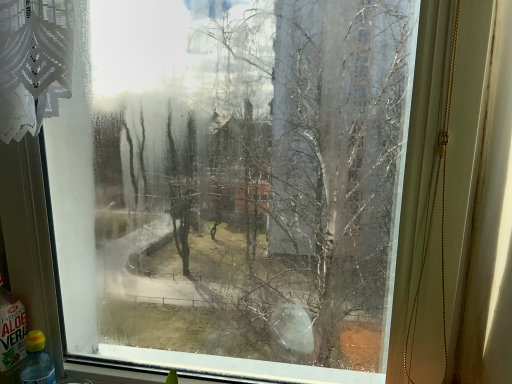
Image resolution: width=512 pixels, height=384 pixels. Describe the element at coordinates (11, 336) in the screenshot. I see `translucent plastic bottle at lower left, which is counted as the 1th bottle, starting from the left` at that location.

Where is `translucent plastic bottle at lower left, which is counted as the 1th bottle, starting from the left`? This screenshot has width=512, height=384. translucent plastic bottle at lower left, which is counted as the 1th bottle, starting from the left is located at coordinates (11, 336).

Locate an element on the screen. This screenshot has height=384, width=512. translucent plastic bottle at lower left, the 1th bottle when ordered from right to left is located at coordinates (37, 361).

What is the approximate width of translucent plastic bottle at lower left, the 1th bottle when ordered from right to left?

It is 3.04 inches.

Image resolution: width=512 pixels, height=384 pixels. What do you see at coordinates (37, 361) in the screenshot?
I see `translucent plastic bottle at lower left, the 1th bottle when ordered from right to left` at bounding box center [37, 361].

Find the location of a particular element. The image size is (512, 384). translucent plastic bottle at lower left, which ranks as the second bottle in right-to-left order is located at coordinates (11, 336).

Consider the image. Which object is positioned more to the right, translucent plastic bottle at lower left, marked as the second bottle in a left-to-right arrangement, or translucent plastic bottle at lower left, which is counted as the 1th bottle, starting from the left?

translucent plastic bottle at lower left, marked as the second bottle in a left-to-right arrangement, is more to the right.

Which object is more forward, translucent plastic bottle at lower left, the 1th bottle when ordered from right to left, or translucent plastic bottle at lower left, which is counted as the 1th bottle, starting from the left?

translucent plastic bottle at lower left, which is counted as the 1th bottle, starting from the left.

Is point (24, 372) behind point (15, 352)?

Yes, point (24, 372) is behind point (15, 352).

From the image's perspective, is translucent plastic bottle at lower left, the 1th bottle when ordered from right to left, on top of translucent plastic bottle at lower left, which ranks as the second bottle in right-to-left order?

No, from the image's perspective, translucent plastic bottle at lower left, the 1th bottle when ordered from right to left, is not on top of translucent plastic bottle at lower left, which ranks as the second bottle in right-to-left order.

From a real-world perspective, is translucent plastic bottle at lower left, the 1th bottle when ordered from right to left, located beneath translucent plastic bottle at lower left, which is counted as the 1th bottle, starting from the left?

Indeed, from a real-world perspective, translucent plastic bottle at lower left, the 1th bottle when ordered from right to left, is positioned beneath translucent plastic bottle at lower left, which is counted as the 1th bottle, starting from the left.

Is translucent plastic bottle at lower left, the 1th bottle when ordered from right to left, wider than translucent plastic bottle at lower left, which is counted as the 1th bottle, starting from the left?

In fact, translucent plastic bottle at lower left, the 1th bottle when ordered from right to left, might be narrower than translucent plastic bottle at lower left, which is counted as the 1th bottle, starting from the left.

Is translucent plastic bottle at lower left, the 1th bottle when ordered from right to left, taller than translucent plastic bottle at lower left, which is counted as the 1th bottle, starting from the left?

Incorrect, the height of translucent plastic bottle at lower left, the 1th bottle when ordered from right to left, is not larger of that of translucent plastic bottle at lower left, which is counted as the 1th bottle, starting from the left.

Between translucent plastic bottle at lower left, the 1th bottle when ordered from right to left, and translucent plastic bottle at lower left, which is counted as the 1th bottle, starting from the left, which one has smaller size?

translucent plastic bottle at lower left, the 1th bottle when ordered from right to left, is smaller.

Do you think translucent plastic bottle at lower left, the 1th bottle when ordered from right to left, is within translucent plastic bottle at lower left, which ranks as the second bottle in right-to-left order, or outside of it?

translucent plastic bottle at lower left, the 1th bottle when ordered from right to left, lies outside translucent plastic bottle at lower left, which ranks as the second bottle in right-to-left order.

Can you see translucent plastic bottle at lower left, marked as the second bottle in a left-to-right arrangement, touching translucent plastic bottle at lower left, which is counted as the 1th bottle, starting from the left?

Yes, translucent plastic bottle at lower left, marked as the second bottle in a left-to-right arrangement, is in contact with translucent plastic bottle at lower left, which is counted as the 1th bottle, starting from the left.

Is translucent plastic bottle at lower left, the 1th bottle when ordered from right to left, positioned with its back to translucent plastic bottle at lower left, which is counted as the 1th bottle, starting from the left?

That's not correct — translucent plastic bottle at lower left, the 1th bottle when ordered from right to left, is not looking away from translucent plastic bottle at lower left, which is counted as the 1th bottle, starting from the left.

Can you tell me how much translucent plastic bottle at lower left, the 1th bottle when ordered from right to left, and translucent plastic bottle at lower left, which ranks as the second bottle in right-to-left order, differ in facing direction?

They differ by 4.54 degrees in their facing directions.

This screenshot has height=384, width=512. Find the location of `bottle on the left of the translucent plastic bottle at lower left, marked as the second bottle in a left-to-right arrangement`. bottle on the left of the translucent plastic bottle at lower left, marked as the second bottle in a left-to-right arrangement is located at coordinates (11, 336).

Which is more to the right, translucent plastic bottle at lower left, which is counted as the 1th bottle, starting from the left, or translucent plastic bottle at lower left, the 1th bottle when ordered from right to left?

From the viewer's perspective, translucent plastic bottle at lower left, the 1th bottle when ordered from right to left, appears more on the right side.

Does translucent plastic bottle at lower left, which ranks as the second bottle in right-to-left order, lie behind translucent plastic bottle at lower left, marked as the second bottle in a left-to-right arrangement?

No, it is not.

Is point (6, 295) less distant than point (40, 364)?

No, it is not.

From the image's perspective, does translucent plastic bottle at lower left, which ranks as the second bottle in right-to-left order, appear lower than translucent plastic bottle at lower left, the 1th bottle when ordered from right to left?

No, from the image's perspective, translucent plastic bottle at lower left, which ranks as the second bottle in right-to-left order, is not below translucent plastic bottle at lower left, the 1th bottle when ordered from right to left.

From a real-world perspective, is translucent plastic bottle at lower left, which is counted as the 1th bottle, starting from the left, above or below translucent plastic bottle at lower left, the 1th bottle when ordered from right to left?

From a real-world perspective, translucent plastic bottle at lower left, which is counted as the 1th bottle, starting from the left, is physically above translucent plastic bottle at lower left, the 1th bottle when ordered from right to left.

Does translucent plastic bottle at lower left, which is counted as the 1th bottle, starting from the left, have a lesser width compared to translucent plastic bottle at lower left, the 1th bottle when ordered from right to left?

No.

Which of these two, translucent plastic bottle at lower left, which ranks as the second bottle in right-to-left order, or translucent plastic bottle at lower left, the 1th bottle when ordered from right to left, stands shorter?

With less height is translucent plastic bottle at lower left, the 1th bottle when ordered from right to left.

Who is bigger, translucent plastic bottle at lower left, which ranks as the second bottle in right-to-left order, or translucent plastic bottle at lower left, marked as the second bottle in a left-to-right arrangement?

Bigger between the two is translucent plastic bottle at lower left, which ranks as the second bottle in right-to-left order.

Is translucent plastic bottle at lower left, the 1th bottle when ordered from right to left, located within translucent plastic bottle at lower left, which ranks as the second bottle in right-to-left order?

That's incorrect, translucent plastic bottle at lower left, the 1th bottle when ordered from right to left, is not inside translucent plastic bottle at lower left, which ranks as the second bottle in right-to-left order.

Is translucent plastic bottle at lower left, which ranks as the second bottle in right-to-left order, beside translucent plastic bottle at lower left, the 1th bottle when ordered from right to left?

Absolutely, translucent plastic bottle at lower left, which ranks as the second bottle in right-to-left order, is next to and touching translucent plastic bottle at lower left, the 1th bottle when ordered from right to left.

Is translucent plastic bottle at lower left, which ranks as the second bottle in right-to-left order, positioned with its back to translucent plastic bottle at lower left, the 1th bottle when ordered from right to left?

No, translucent plastic bottle at lower left, the 1th bottle when ordered from right to left, is not at the back of translucent plastic bottle at lower left, which ranks as the second bottle in right-to-left order.

Measure the distance between translucent plastic bottle at lower left, which is counted as the 1th bottle, starting from the left, and translucent plastic bottle at lower left, the 1th bottle when ordered from right to left.

translucent plastic bottle at lower left, which is counted as the 1th bottle, starting from the left, is 1.49 inches away from translucent plastic bottle at lower left, the 1th bottle when ordered from right to left.

Locate an element on the screen. Image resolution: width=512 pixels, height=384 pixels. bottle below the translucent plastic bottle at lower left, which ranks as the second bottle in right-to-left order (from a real-world perspective) is located at coordinates (37, 361).

The image size is (512, 384). In order to click on bottle that is on the right side of translucent plastic bottle at lower left, which is counted as the 1th bottle, starting from the left in this screenshot , I will do `click(37, 361)`.

In the image, there is a translucent plastic bottle at lower left, which ranks as the second bottle in right-to-left order. At what (x,y) coordinates should I click in order to perform the action: click on bottle below it (from the image's perspective). Please return your answer as a coordinate pair (x, y). Looking at the image, I should click on (37, 361).